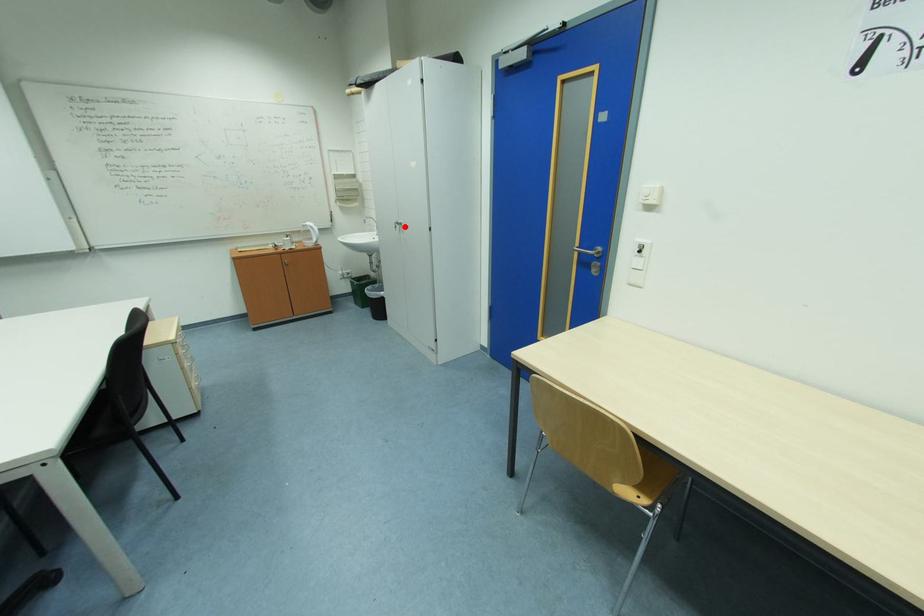
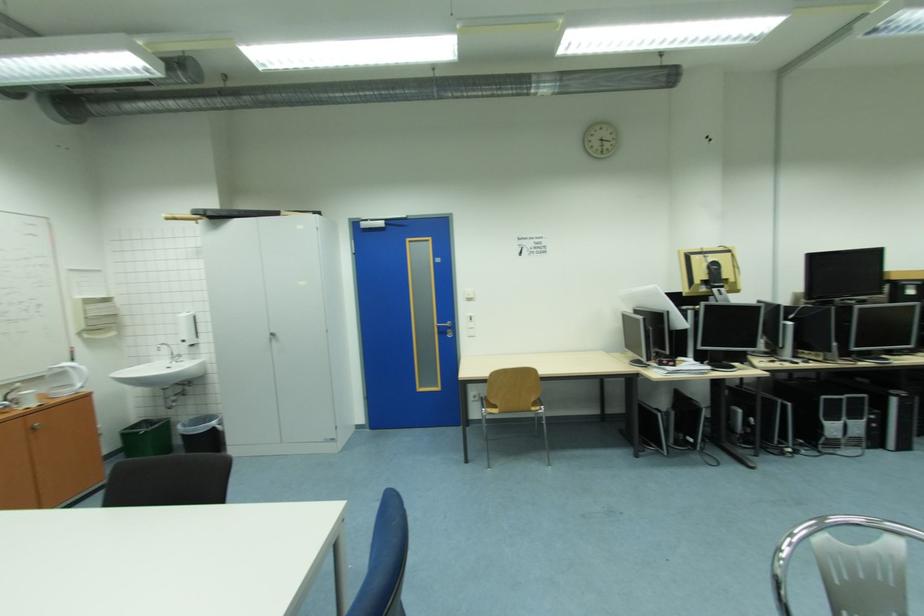
Where in the second image is the point corresponding to the highlighted location from the first image?

(278, 338)